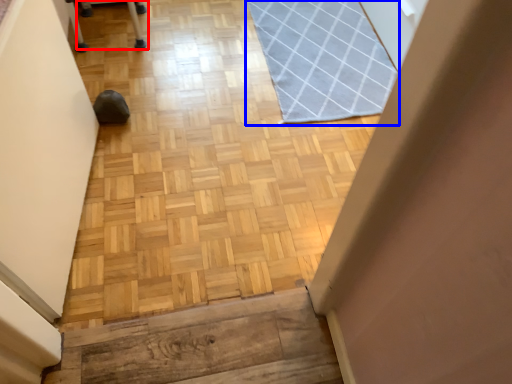
Question: Among these objects, which one is nearest to the camera, furniture (highlighted by a red box) or mat (highlighted by a blue box)?

Choices:
 (A) furniture
 (B) mat

Answer: (B)